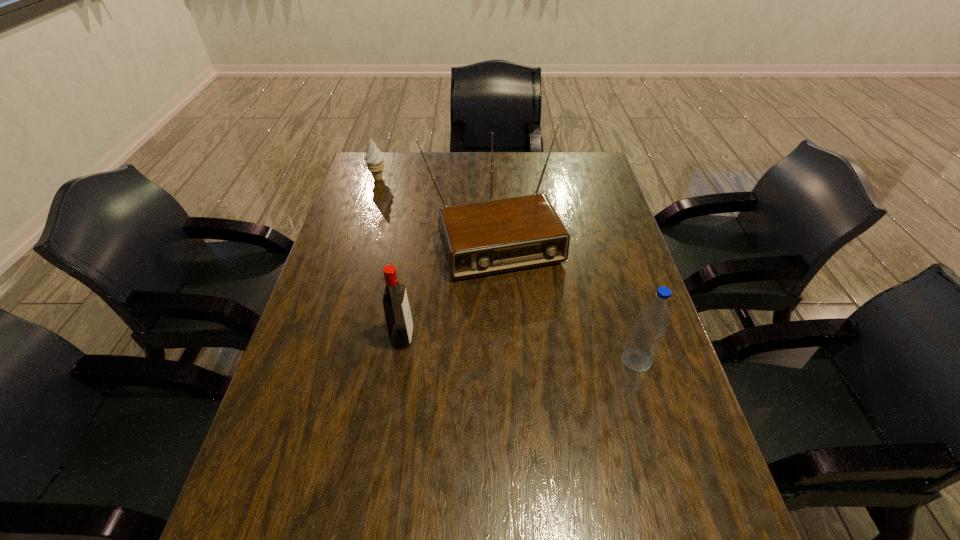
At what (x,y) coordinates should I click in order to perform the action: click on vacant space on the desktop that is between the vodka and the water bottle and is positioned on the front-facing side of the icecream. Please return your answer as a coordinate pair (x, y). The height and width of the screenshot is (540, 960). Looking at the image, I should click on (509, 348).

The height and width of the screenshot is (540, 960). In order to click on vacant space on the desktop that is between the vodka and the water bottle and is positioned on the front panel of the radio_receiver in this screenshot , I will do `click(540, 351)`.